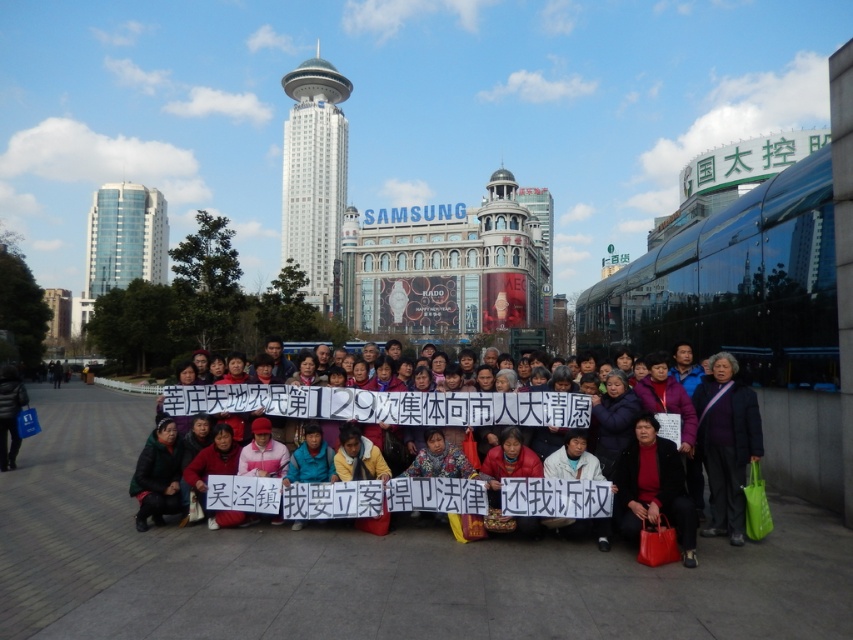
You are standing in the public square and want to reach the multicolored fabric banner at center. If your walking speed is 3 feet per second, how many seconds will it take you to reach the banner?

The distance between you and the multicolored fabric banner at center is 173.16 feet. At a walking speed of 3 feet per second, it would take approximately 57.72 seconds to reach the banner.

You are a photographer standing at the edge of the square. You want to capture a photo of the multicolored fabric banner at center without any people blocking it. Based on the scene description, is the banner visible from your position?

The multicolored fabric banner at center is located at point (392, 404), which is at the center of the image. Since the description mentions the banner is prominently displayed in front of the group, it should be visible without obstruction from the edge of the square.

You are a photographer trying to capture a wide shot of the protest scene. You notice the multicolored fabric banner at center and the white glass tower at center in your viewfinder. Given their sizes, which object will appear wider in your photo?

The multicolored fabric banner at center will appear wider in the photo because its width is larger than that of the white glass tower at center.